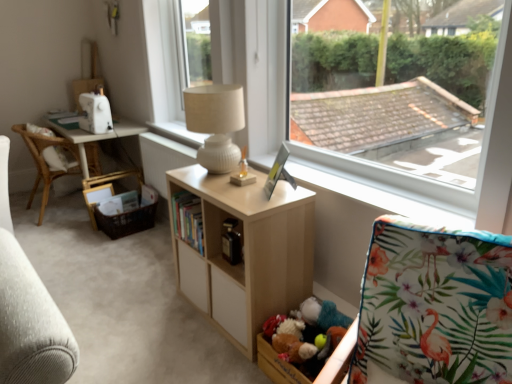
Question: Is point (151, 87) positioned closer to the camera than point (179, 130)?

Choices:
 (A) closer
 (B) farther

Answer: (B)

Question: Based on their positions, is white plastic window frame at upper center located to the left or right of white textured lamp at upper center?

Choices:
 (A) right
 (B) left

Answer: (A)

Question: Based on their relative distances, which object is farther from the white ribbed ceramic lamp at upper center?

Choices:
 (A) white wood table at left
 (B) light wood shelf at center
 (C) transparent glass window at upper center
 (D) hardcover books at center
 (E) wooden toy box at lower center

Answer: (A)

Question: Which object is positioned closest to the transparent glass window at upper center?

Choices:
 (A) light wood shelf at center
 (B) brown woven picnic basket at lower left
 (C) hardcover books at center
 (D) wooden toy box at lower center
 (E) white textured lamp at upper center

Answer: (C)